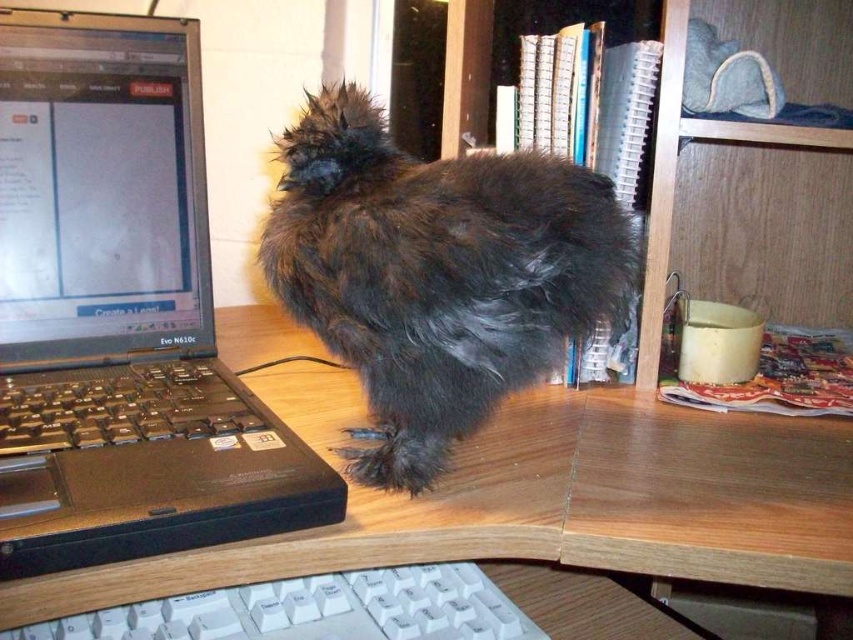
You are sitting at the desk and see two points marked on the desk surface. The first point is at the location of point (326, 113) and the second point is at point (734, 192). If you want to place a small sticker on the point that is closer to you, which point should you choose?

Point (326, 113) is in front of point (734, 192), so you should choose point (326, 113) to place the sticker as it is closer to you.

You are trying to place a new mouse pad between the wooden at center and the white plastic keyboard at lower center. Based on their widths, which object should the mouse pad be placed closer to?

The wooden at center is wider than the white plastic keyboard at lower center, so the mouse pad should be placed closer to the white plastic keyboard at lower center to ensure proper spacing.